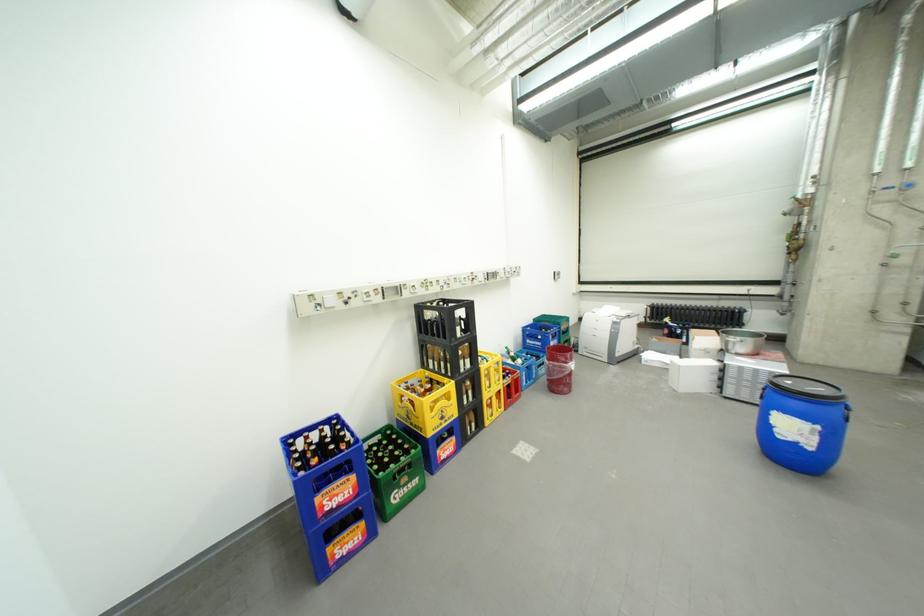
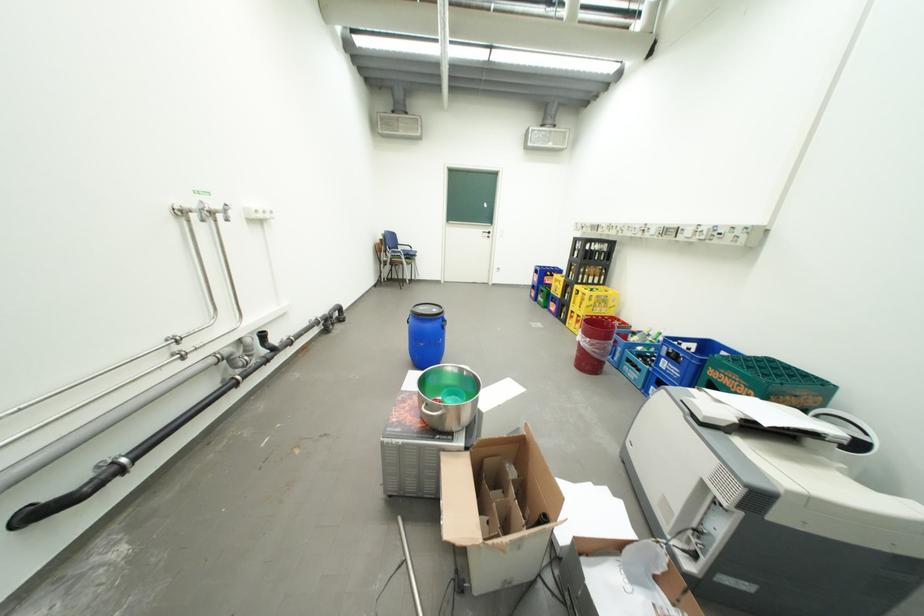
The point at (x=509, y=385) is marked in the first image. Where is the corresponding point in the second image?

(590, 312)